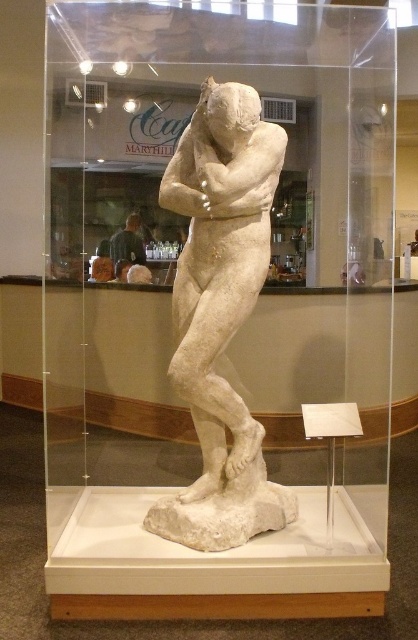
Question: Which point is closer to the camera taking this photo?

Choices:
 (A) (117, 246)
 (B) (247, 278)

Answer: (B)

Question: Can you confirm if white marble statue at center is positioned to the left of dark gray shirt at center?

Choices:
 (A) yes
 (B) no

Answer: (B)

Question: Can you confirm if white marble statue at center is positioned below dark gray shirt at center?

Choices:
 (A) no
 (B) yes

Answer: (B)

Question: Which object appears farthest from the camera in this image?

Choices:
 (A) white marble statue at center
 (B) dark gray shirt at center

Answer: (B)

Question: Is white marble statue at center closer to the viewer compared to dark gray shirt at center?

Choices:
 (A) yes
 (B) no

Answer: (A)

Question: Which of the following is the closest to the observer?

Choices:
 (A) (122, 253)
 (B) (219, 196)

Answer: (B)